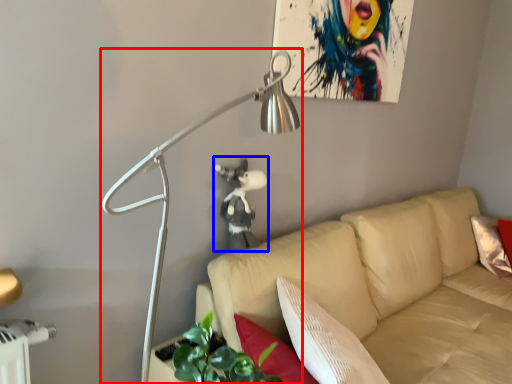
Question: Among these objects, which one is farthest to the camera, lamp (highlighted by a red box) or person (highlighted by a blue box)?

Choices:
 (A) lamp
 (B) person

Answer: (B)